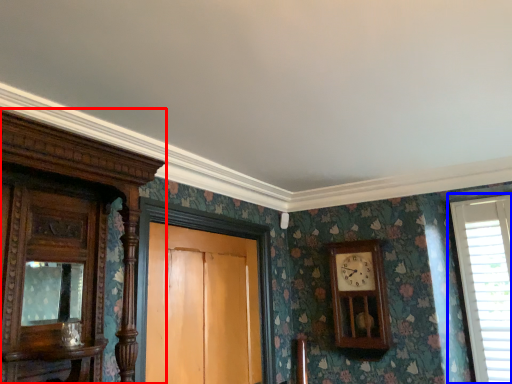
Question: Which object appears farthest to the camera in this image, cabinetry (highlighted by a red box) or window (highlighted by a blue box)?

Choices:
 (A) cabinetry
 (B) window

Answer: (B)